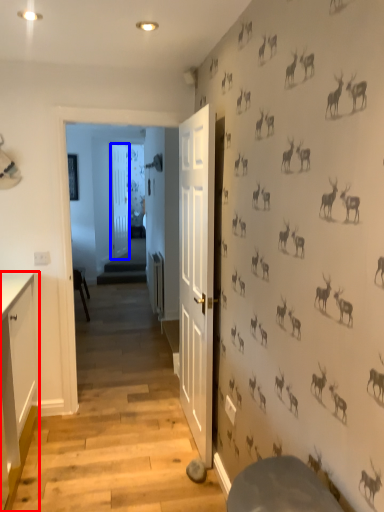
Question: Which of the following is the closest to the observer, cabinetry (highlighted by a red box) or door (highlighted by a blue box)?

Choices:
 (A) cabinetry
 (B) door

Answer: (A)